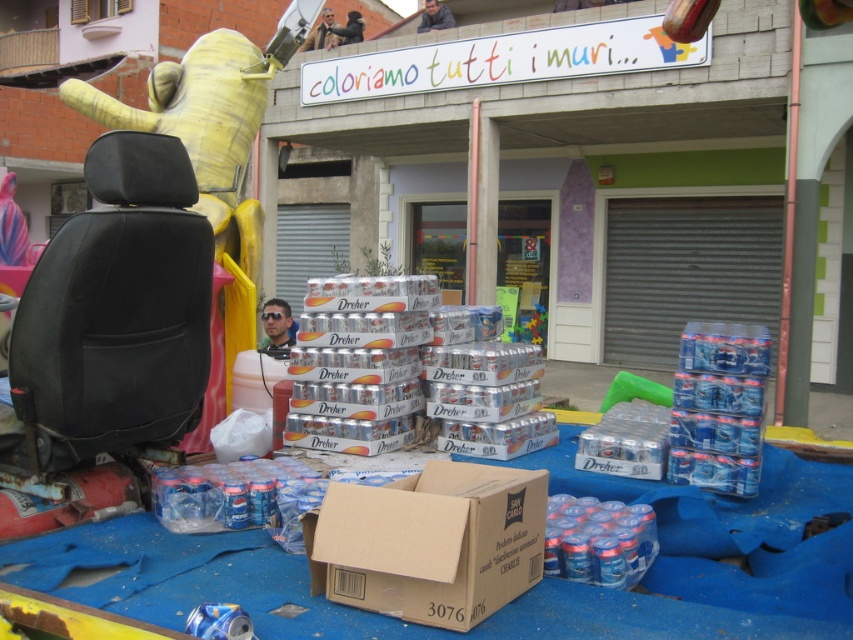
You are standing in front of the scene and want to take a photo. You notice two points marked in the image. Which point, point (42, 314) or point (440, 480), is closer to your camera?

Point (42, 314) is further to the camera than point (440, 480), so the closer point to your camera is point (440, 480).

You are setting up a display and need to place the black leather seat at left and the brown cardboard box at center. Which object should you place first if you want to arrange them from thinnest to widest?

Since the black leather seat at left is thinner than the brown cardboard box at center, you should place the black leather seat at left first when arranging from thinnest to widest.